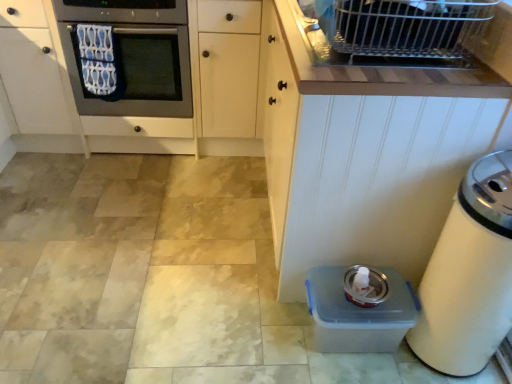
Question: Looking at the image, does white wood cabinet at lower right seem bigger or smaller compared to clear plastic container at lower right?

Choices:
 (A) big
 (B) small

Answer: (A)

Question: Is white wood cabinet at lower right taller or shorter than clear plastic container at lower right?

Choices:
 (A) tall
 (B) short

Answer: (A)

Question: Which is farther from the white plastic trash can at lower right?

Choices:
 (A) white wood cabinet at lower right
 (B) clear plastic container at lower right
 (C) metallic gray oven at left

Answer: (C)

Question: Considering the real-world distances, which object is farthest from the metallic gray oven at left?

Choices:
 (A) clear plastic container at lower right
 (B) white wood cabinet at lower right
 (C) white plastic trash can at lower right

Answer: (C)